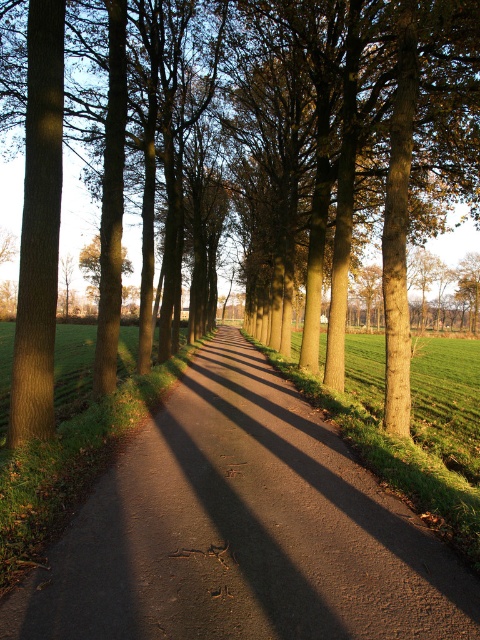
Question: Can you confirm if brown textured tree at center is thinner than dark brown asphalt at center?

Choices:
 (A) yes
 (B) no

Answer: (B)

Question: Which point is farther to the camera?

Choices:
 (A) (425, 125)
 (B) (122, 568)

Answer: (A)

Question: Is brown textured tree at center closer to the viewer compared to dark brown asphalt at center?

Choices:
 (A) no
 (B) yes

Answer: (A)

Question: Where is brown textured tree at center located in relation to dark brown asphalt at center in the image?

Choices:
 (A) left
 (B) right

Answer: (A)